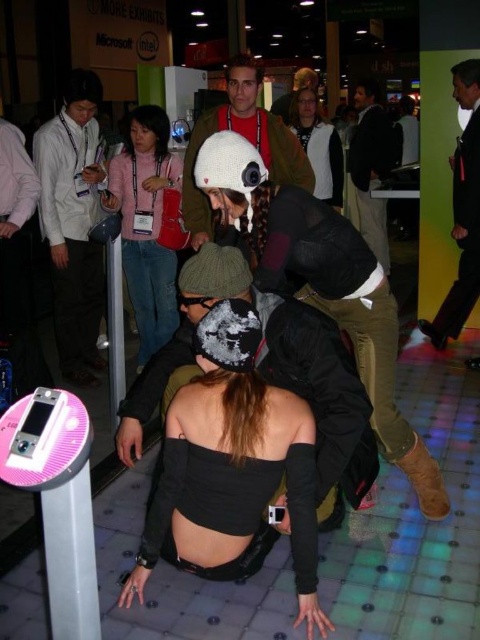
Question: Is white knitted hat at center above matte black jacket at upper center?

Choices:
 (A) yes
 (B) no

Answer: (B)

Question: Which of the following is the farthest from the observer?

Choices:
 (A) (96, 179)
 (B) (300, 76)

Answer: (B)

Question: Which object appears closest to the camera in this image?

Choices:
 (A) matte black jacket at upper center
 (B) black leather jacket at upper right
 (C) black matte top at center
 (D) matte white jacket at upper center

Answer: (C)

Question: Which point is closer to the camera?

Choices:
 (A) black matte top at center
 (B) dark brown leather jacket at upper center

Answer: (A)

Question: Does white knitted hat at center come behind matte black jacket at upper center?

Choices:
 (A) yes
 (B) no

Answer: (B)

Question: Can you confirm if black matte beanie at center is positioned above white fabric shirt at left?

Choices:
 (A) no
 (B) yes

Answer: (A)